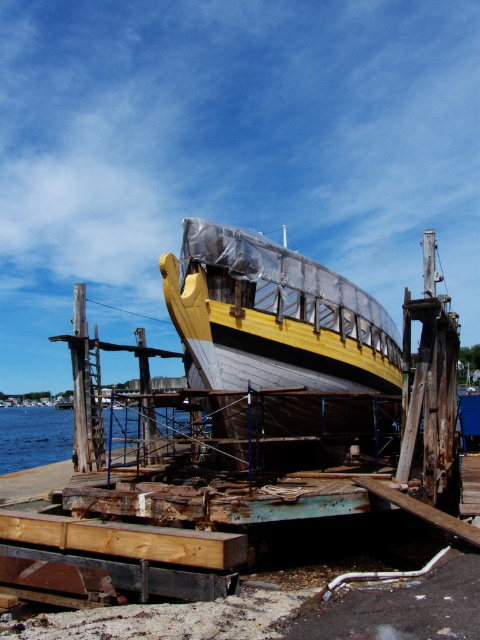
You are a dock worker assessing the space needed for a new project. The yellow wooden boat at center and the blue water at lower left are both part of the current layout. Which area takes up more space?

The blue water at lower left occupies more space than the yellow wooden boat at center, as the yellow wooden boat at center occupies less space than blue water at lower left.

You are a dock worker who needs to move a heavy crate from the yellow wooden boat at center to the blue water at lower left. Considering the width of the boat and the water area, will the crate fit through the space available between them?

The yellow wooden boat at center is narrower than the blue water at lower left, so the crate should fit through the space available between them as the water area is wider.

You are standing at the dockside observing the ship under construction. There are two points marked on the platform supporting the boat. The first point is at coordinates point (347, 385) and the second at point (8, 413). Which point is nearer to your current position?

Point (347, 385) is closer to the camera than point (8, 413), so the first point is nearer to your current position.